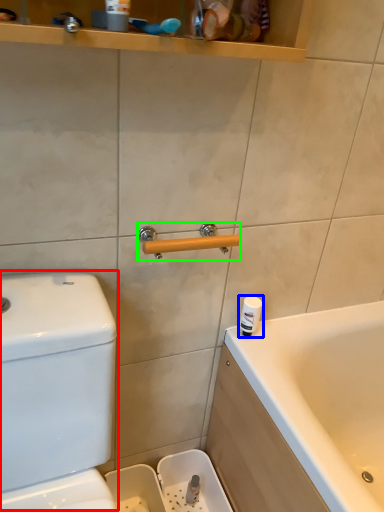
Question: Which is farther away from water tank (highlighted by a red box)? toiletry (highlighted by a blue box) or door handle (highlighted by a green box)?

Choices:
 (A) toiletry
 (B) door handle

Answer: (A)